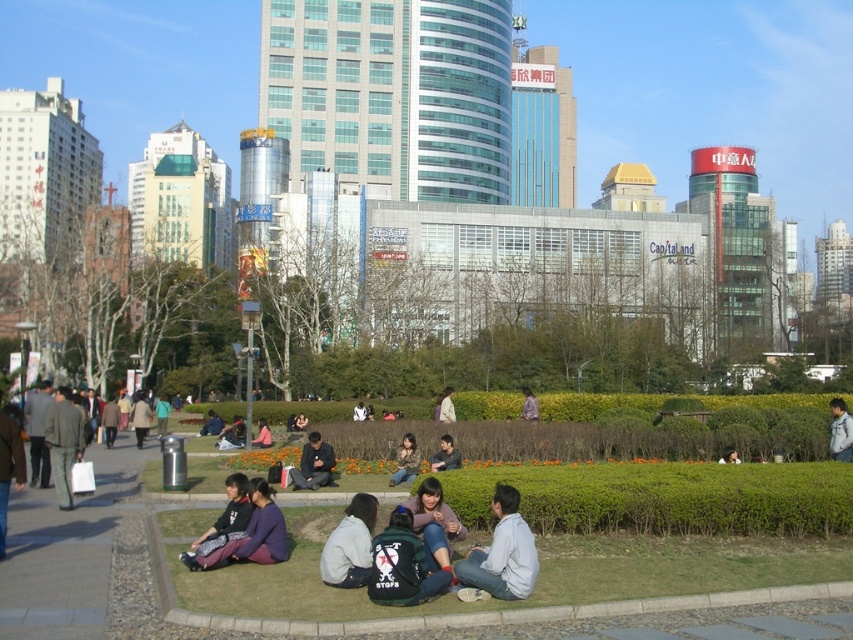
You are a photographer standing at the edge of the park, looking towards the grassy area. You want to capture both the dark purple sweater at lower center and the light brown fabric jacket at center in the same frame. Based on their positions, which one will appear closer to the top of the photo?

The dark purple sweater at lower center appears closer to the top of the photo because it is positioned above the light brown fabric jacket at center.

You are standing at the entrance of the park and want to reach a specific location marked by point coordinates. The point is at coordinates point (x=450, y=438). If you can walk 3 meters per minute, how many minutes will it take you to reach that point?

The distance of point (x=450, y=438) from viewer is 22.22 meters. At a walking speed of 3 meters per minute, it will take approximately 7.41 minutes to reach the point.

You are a photographer trying to capture a candid shot of the dark purple sweater at lower center and the light brown fabric jacket at center. Since you want to ensure both subjects are in focus, you need to know which one is shorter. Which object has a smaller height?

The dark purple sweater at lower center has a lesser height compared to the light brown fabric jacket at center, so the dark purple sweater at lower center is shorter.